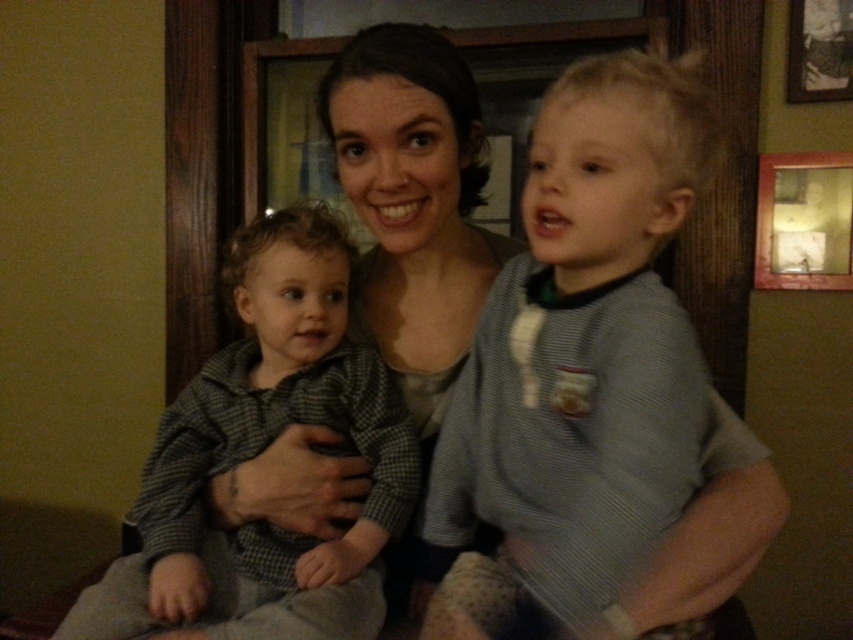
Question: Does gray striped shirt at right have a larger size compared to checkered fabric toddler at center?

Choices:
 (A) yes
 (B) no

Answer: (A)

Question: Which point is closer to the camera?

Choices:
 (A) gray striped shirt at right
 (B) checkered fabric toddler at center

Answer: (A)

Question: Which object is closer to the camera taking this photo?

Choices:
 (A) checkered fabric toddler at center
 (B) gray striped shirt at right

Answer: (B)

Question: Does gray striped shirt at right appear under checkered fabric toddler at center?

Choices:
 (A) no
 (B) yes

Answer: (A)

Question: Can you confirm if gray striped shirt at right is bigger than checkered fabric toddler at center?

Choices:
 (A) no
 (B) yes

Answer: (B)

Question: Which object is closer to the camera taking this photo?

Choices:
 (A) checkered fabric toddler at center
 (B) gray striped shirt at right

Answer: (B)